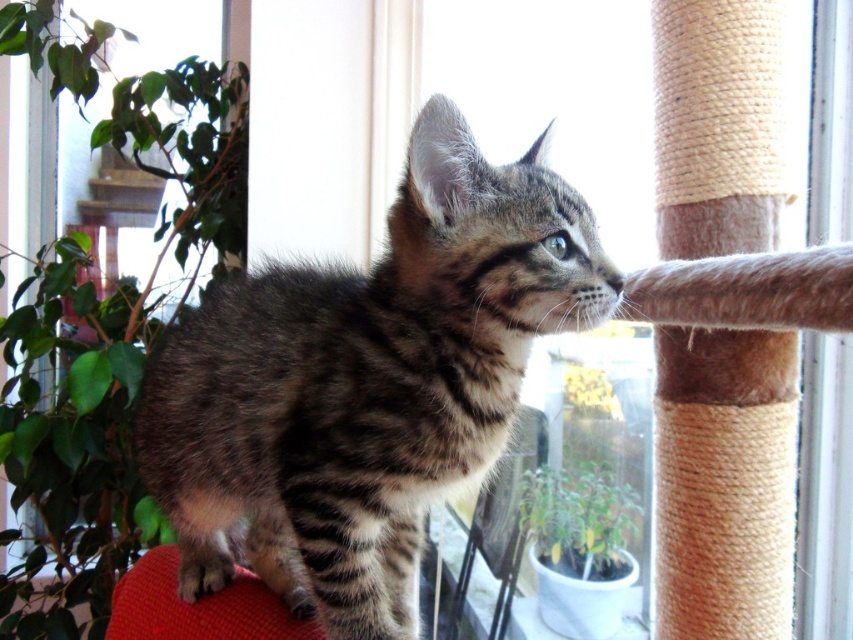
Does striped fur cat at center appear on the right side of green matte plant at lower center?

In fact, striped fur cat at center is to the left of green matte plant at lower center.

What are the coordinates of `striped fur cat at center` in the screenshot? It's located at (366, 381).

Where is `striped fur cat at center`? The image size is (853, 640). striped fur cat at center is located at coordinates (366, 381).

Between striped fur cat at center and green leafy plant at left, which one appears on the right side from the viewer's perspective?

Positioned to the right is striped fur cat at center.

Is striped fur cat at center bigger than green leafy plant at left?

No, striped fur cat at center is not bigger than green leafy plant at left.

Who is more forward, (390, 486) or (65, 406)?

Point (390, 486) is more forward.

At what (x,y) coordinates should I click in order to perform the action: click on striped fur cat at center. Please return your answer as a coordinate pair (x, y). The width and height of the screenshot is (853, 640). Looking at the image, I should click on (366, 381).

Does green leafy plant at left appear on the right side of green matte plant at lower center?

Incorrect, green leafy plant at left is not on the right side of green matte plant at lower center.

Between point (74, 509) and point (561, 536), which one is positioned behind?

Point (74, 509)

Where is `green leafy plant at left`? green leafy plant at left is located at coordinates (100, 316).